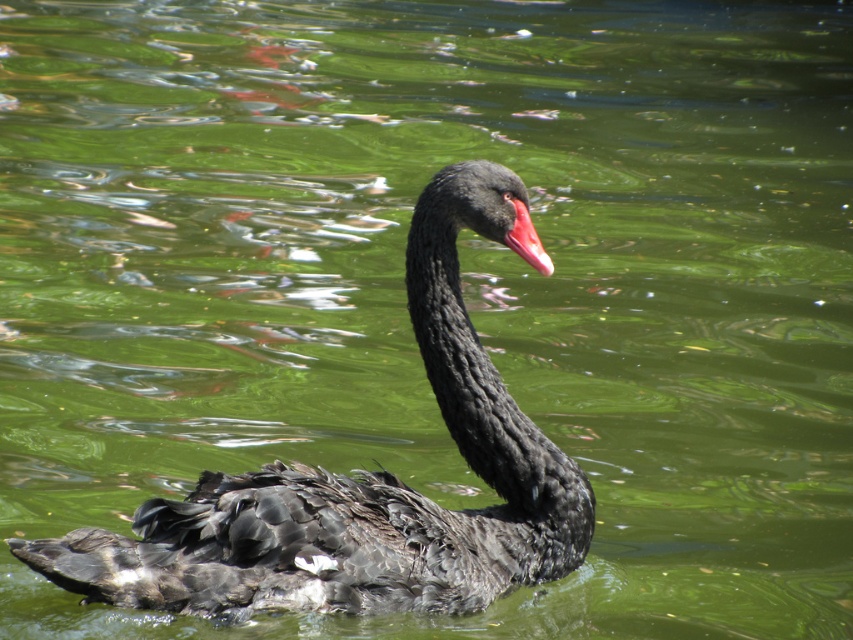
Question: Which of the following is the farthest from the observer?

Choices:
 (A) (448, 218)
 (B) (526, 209)

Answer: (B)

Question: Which of the following is the closest to the observer?

Choices:
 (A) (281, 573)
 (B) (532, 234)

Answer: (A)

Question: Is shiny black swan at center in front of matte pink beak at center?

Choices:
 (A) no
 (B) yes

Answer: (B)

Question: Is shiny black swan at center below matte pink beak at center?

Choices:
 (A) yes
 (B) no

Answer: (A)

Question: From the image, what is the correct spatial relationship of shiny black swan at center in relation to matte pink beak at center?

Choices:
 (A) right
 (B) left

Answer: (B)

Question: Among these objects, which one is nearest to the camera?

Choices:
 (A) matte pink beak at center
 (B) shiny black swan at center

Answer: (B)